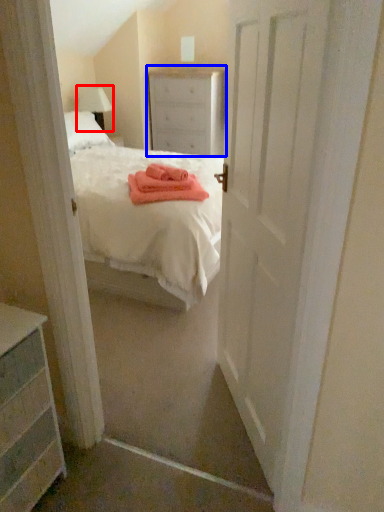
Question: Among these objects, which one is nearest to the camera, lamp (highlighted by a red box) or nightstand (highlighted by a blue box)?

Choices:
 (A) lamp
 (B) nightstand

Answer: (A)